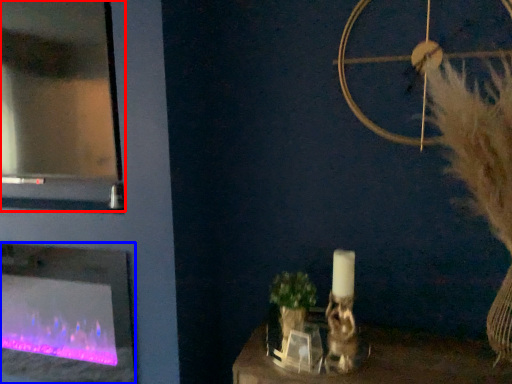
Question: Which object appears farthest to the camera in this image, glass door (highlighted by a red box) or fireplace (highlighted by a blue box)?

Choices:
 (A) glass door
 (B) fireplace

Answer: (B)